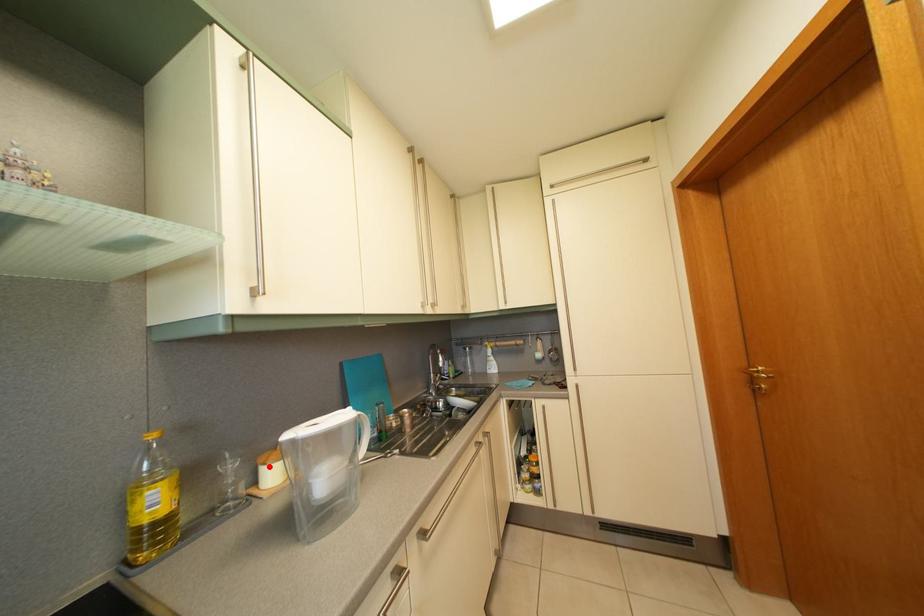
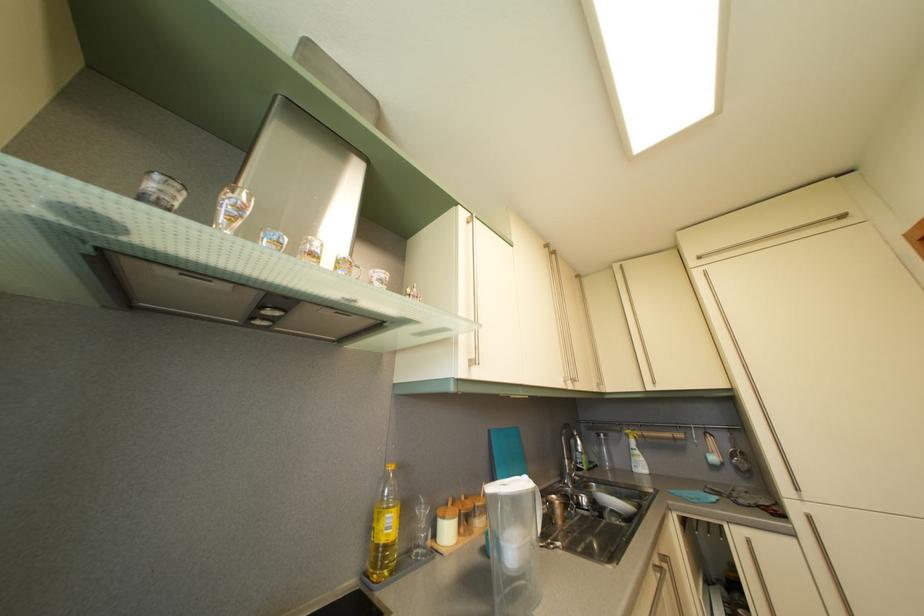
In the second image, find the point that corresponds to the highlighted location in the first image.

(448, 519)